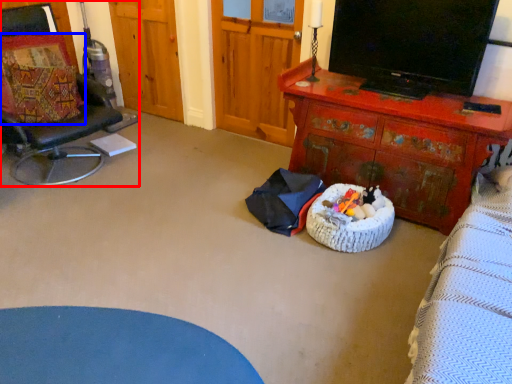
Question: Which point is closer to the camera, chair (highlighted by a red box) or pillow (highlighted by a blue box)?

Choices:
 (A) chair
 (B) pillow

Answer: (A)